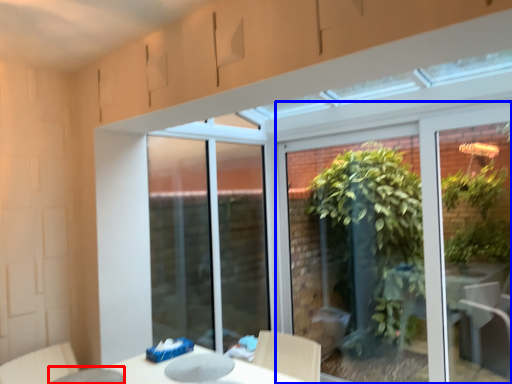
Question: Which point is further to the camera, glass table (highlighted by a red box) or window (highlighted by a blue box)?

Choices:
 (A) glass table
 (B) window

Answer: (B)